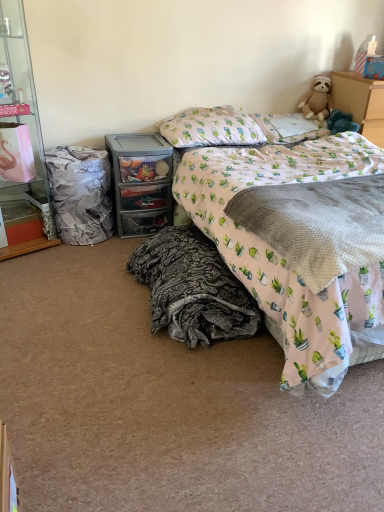
At what (x,y) coordinates should I click in order to perform the action: click on free space in front of dark gray textured blanket at lower center, the second blanket viewed from the right. Please return your answer as a coordinate pair (x, y). This screenshot has height=512, width=384. Looking at the image, I should click on (166, 392).